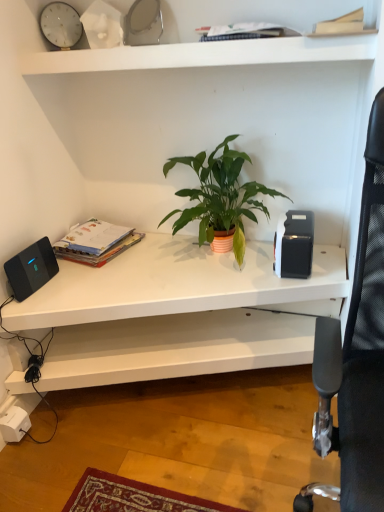
Locate an element on the screen. The height and width of the screenshot is (512, 384). free space between black matte speaker at left and black plastic toaster at right is located at coordinates (160, 272).